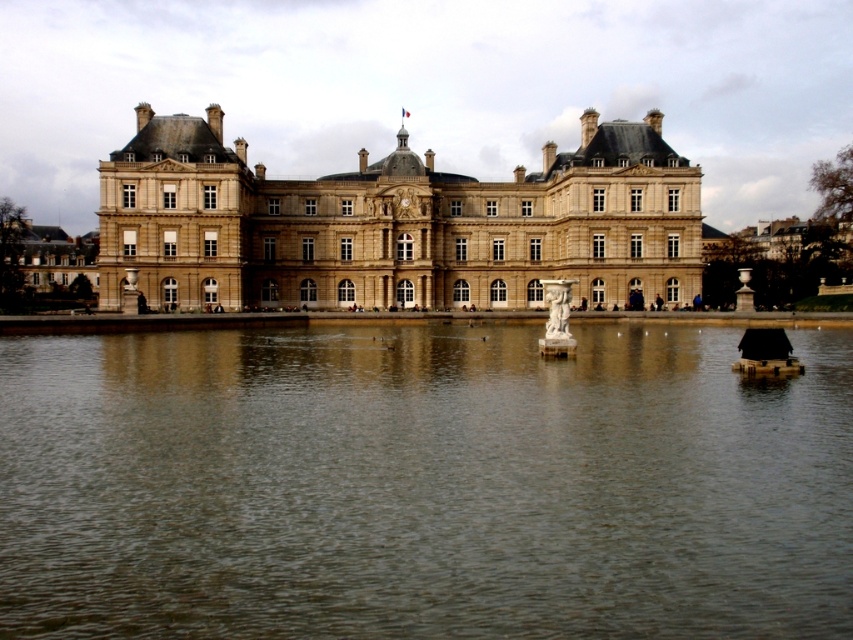
You are standing at the point labeled point (480, 209) and want to walk to the statue in the center of the water. If you walk straight ahead, will you pass by the point labeled point (721, 413) before reaching the statue?

Yes, because point (721, 413) is in front of point (480, 209), so walking straight towards the statue would first pass point (721, 413) before reaching the statue.

You are standing at the point with coordinates point (396, 225) in the image. What object are you facing?

The point (396, 225) corresponds to the brown stone building at center, so you are facing the brown stone building at center.

You are a tourist visiting the historical site and want to take a photo of the brown stone building at center and its reflection in the brown reflective water at center. Can you tell me if the reflection is visible in the photo?

The brown reflective water at center is below the brown stone building at center, so the reflection of the building would be visible in the water since the water is positioned directly beneath the building.